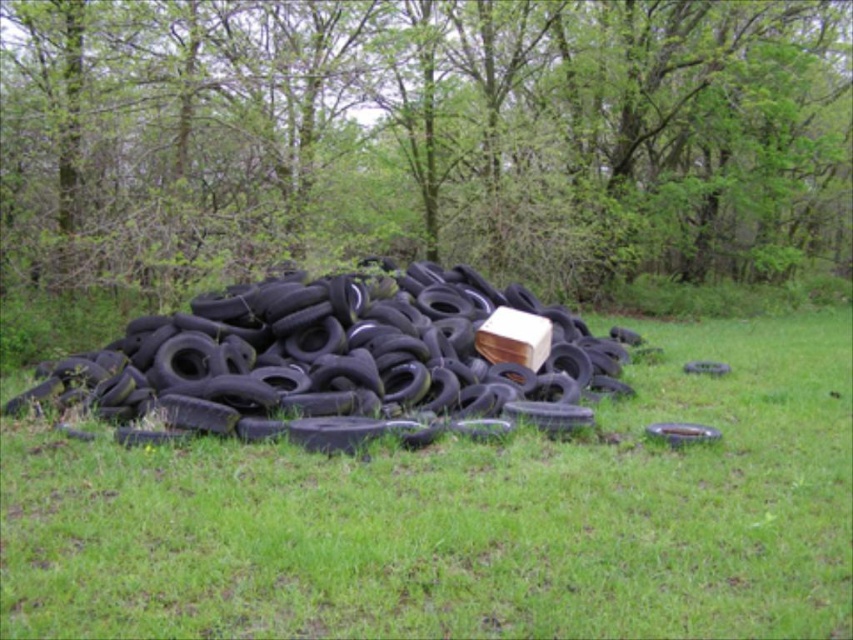
Does green grass at center have a greater width compared to black rubber tire at center?

Correct, the width of green grass at center exceeds that of black rubber tire at center.

Is point (833, 376) less distant than point (708, 362)?

Yes.

Locate an element on the screen. green grass at center is located at coordinates (466, 516).

This screenshot has width=853, height=640. In order to click on green grass at center in this screenshot , I will do `click(466, 516)`.

Consider the image. Measure the distance between point (312,221) and camera.

Point (312,221) is 46.10 feet away from camera.

Who is lower down, green leafy tree at center or black rubber tire at center?

black rubber tire at center

Between point (32, 173) and point (711, 369), which one is positioned in front?

Point (711, 369) is more forward.

Locate an element on the screen. green leafy tree at center is located at coordinates (426, 132).

Between green leafy tree at center and black rubber tire at lower right, which one appears on the right side from the viewer's perspective?

From the viewer's perspective, green leafy tree at center appears more on the right side.

Is green leafy tree at center taller than black rubber tire at lower right?

Yes.

Between point (201, 160) and point (680, 440), which one is positioned behind?

Positioned behind is point (201, 160).

The image size is (853, 640). Find the location of `green leafy tree at center`. green leafy tree at center is located at coordinates (426, 132).